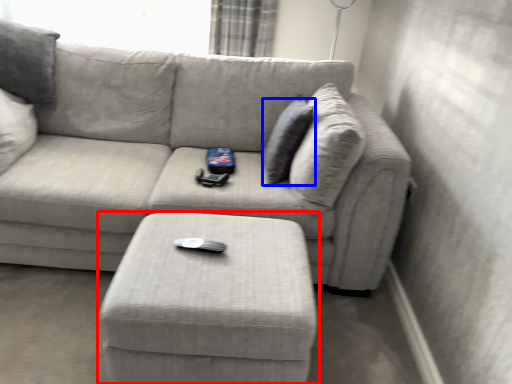
Question: Which of the following is the farthest to the observer, table (highlighted by a red box) or pillow (highlighted by a blue box)?

Choices:
 (A) table
 (B) pillow

Answer: (B)